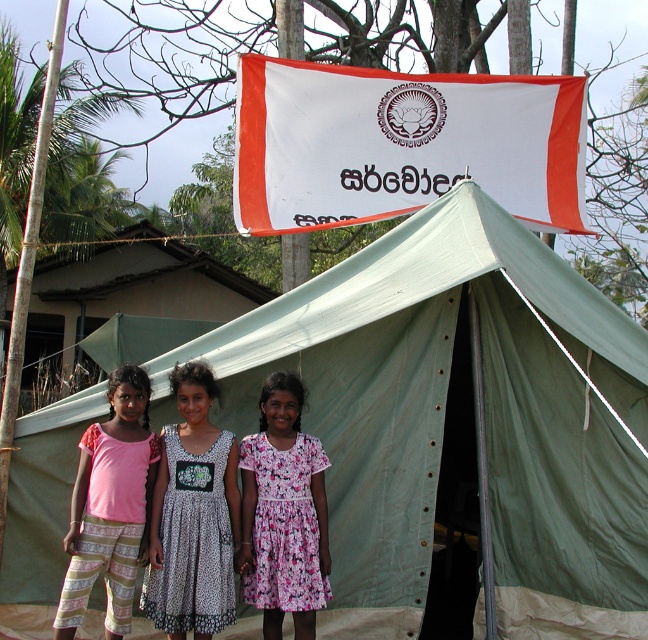
You are standing in the middle of the image and want to walk towards the green canvas tent at center. In which direction should you move?

The green canvas tent at center is located at point [457,426] in 2D coordinates. Since you are at the center of the image, which is point [324,320], you should move towards the northeast direction to reach the green canvas tent at center.